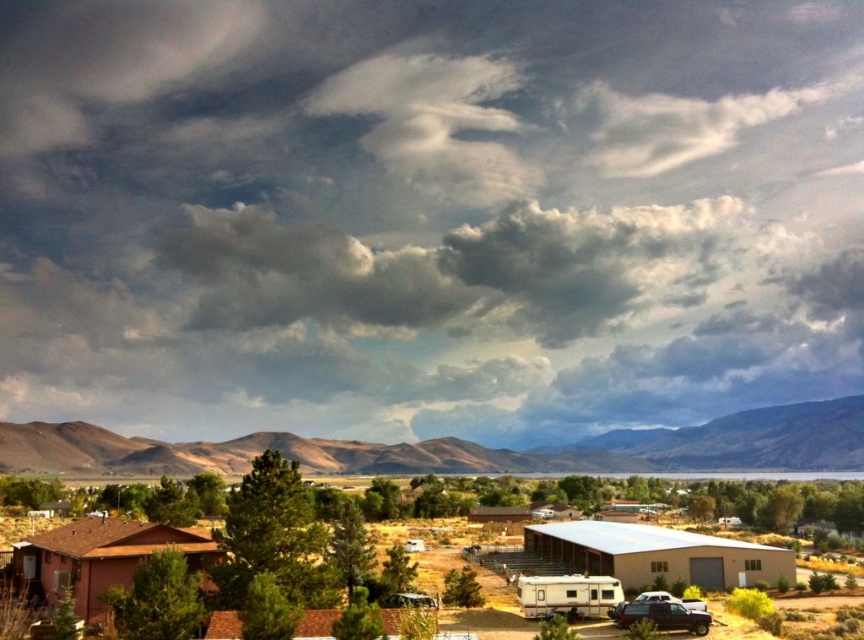
Question: Can you confirm if brown/dry soil at center is positioned below white matte recreational vehicle at center?

Choices:
 (A) no
 (B) yes

Answer: (B)

Question: Can you confirm if cloudy sky at upper center is thinner than brown wood park at lower center?

Choices:
 (A) no
 (B) yes

Answer: (A)

Question: Is brown wood park at lower center thinner than white plastic trailer at center?

Choices:
 (A) yes
 (B) no

Answer: (B)

Question: Based on their relative distances, which object is farther from the cloudy sky at upper center?

Choices:
 (A) white matte recreational vehicle at center
 (B) shiny black suv at lower right
 (C) brown wood park at lower center

Answer: (B)

Question: Considering the real-world distances, which object is closest to the white plastic trailer at center?

Choices:
 (A) brown wood park at lower center
 (B) brown/dry soil at center
 (C) shiny black suv at lower right

Answer: (C)

Question: Which of the following is the closest to the observer?

Choices:
 (A) (627, 518)
 (B) (658, 621)

Answer: (B)